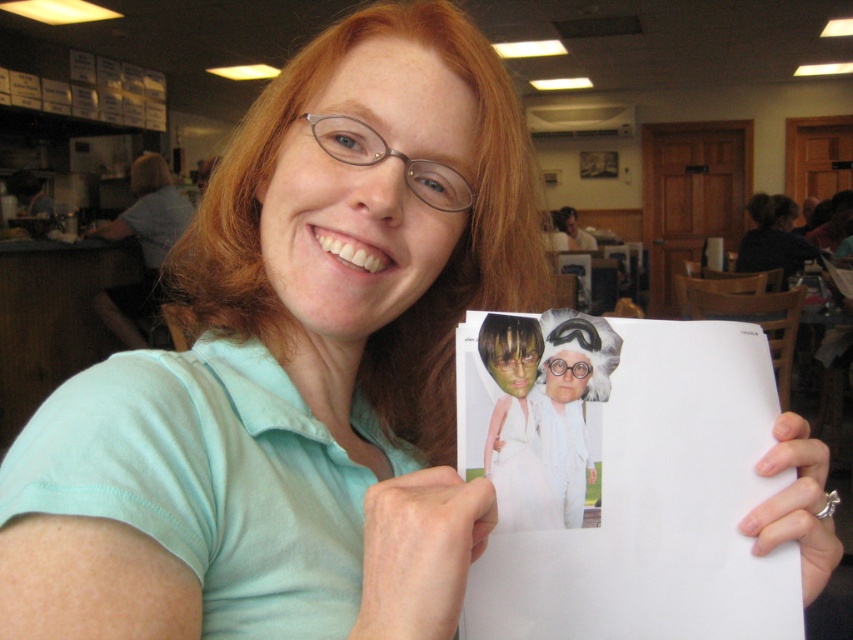
Is matte white dress at center wider than white paper at center?

Incorrect, matte white dress at center's width does not surpass white paper at center's.

Between matte white dress at center and white paper at center, which one appears on the right side from the viewer's perspective?

white paper at center

Which is in front, point (538, 352) or point (566, 426)?

Point (566, 426) is in front.

Identify the location of matte white dress at center. This screenshot has height=640, width=853. (515, 426).